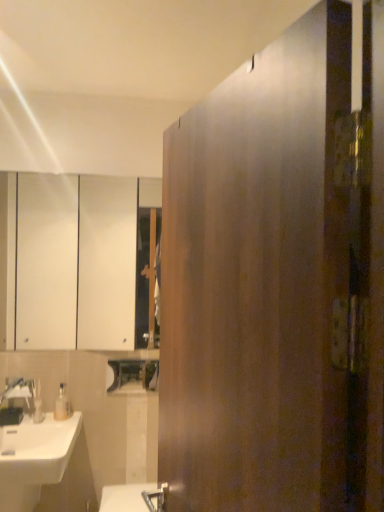
Question: Which is correct: translucent plastic soap dispenser at lower left is inside brushed metal faucet at lower left, or outside of it?

Choices:
 (A) outside
 (B) inside

Answer: (A)

Question: Considering their positions, is translucent plastic soap dispenser at lower left located in front of or behind brushed metal faucet at lower left?

Choices:
 (A) behind
 (B) front

Answer: (A)

Question: Considering the real-world distances, which object is farthest from the white glossy cabinet at upper left?

Choices:
 (A) matte plastic soap dispenser at lower left
 (B) white glossy sink at lower left
 (C) translucent plastic soap dispenser at lower left
 (D) satin wood door at center
 (E) brushed metal faucet at lower left

Answer: (D)

Question: Estimate the real-world distances between objects in this image. Which object is closer to the white glossy cabinet at upper left?

Choices:
 (A) matte plastic soap dispenser at lower left
 (B) white glossy sink at lower left
 (C) satin wood door at center
 (D) translucent plastic soap dispenser at lower left
 (E) brushed metal faucet at lower left

Answer: (E)